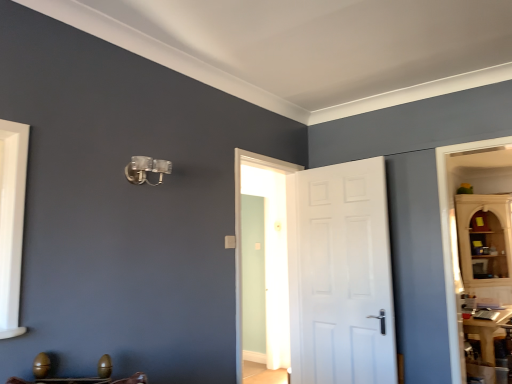
Measure the distance between white matte door at center and camera.

The distance of white matte door at center from camera is 9.39 feet.

Identify the location of white matte door at center. (340, 275).

Image resolution: width=512 pixels, height=384 pixels. What do you see at coordinates (340, 275) in the screenshot?
I see `white matte door at center` at bounding box center [340, 275].

What is the approximate width of wooden egg-shaped objects at lower left?

The width of wooden egg-shaped objects at lower left is 14.13 inches.

The height and width of the screenshot is (384, 512). Describe the element at coordinates (78, 378) in the screenshot. I see `wooden egg-shaped objects at lower left` at that location.

You are a GUI agent. You are given a task and a screenshot of the screen. Output one action in this format:
    pyautogui.click(x=<x>, y=<y>)
    Task: Click on the wooden egg-shaped objects at lower left
    
    Given the screenshot: What is the action you would take?
    pyautogui.click(x=78, y=378)

You are a GUI agent. You are given a task and a screenshot of the screen. Output one action in this format:
    pyautogui.click(x=<x>, y=<y>)
    Task: Click on the white matte door at center
    
    Given the screenshot: What is the action you would take?
    pyautogui.click(x=340, y=275)

Would you say wooden egg-shaped objects at lower left is to the left or to the right of white matte door at center in the picture?

Based on their positions, wooden egg-shaped objects at lower left is located to the left of white matte door at center.

Which object is closer to the camera, wooden egg-shaped objects at lower left or white matte door at center?

wooden egg-shaped objects at lower left.

Which is in front, point (76, 382) or point (303, 364)?

Point (76, 382)

From the image's perspective, is wooden egg-shaped objects at lower left positioned above or below white matte door at center?

Based on their image positions, wooden egg-shaped objects at lower left is located beneath white matte door at center.

From a real-world perspective, which is physically above, wooden egg-shaped objects at lower left or white matte door at center?

white matte door at center.

Is wooden egg-shaped objects at lower left wider than white matte door at center?

Yes.

Is wooden egg-shaped objects at lower left shorter than white matte door at center?

Yes, wooden egg-shaped objects at lower left is shorter than white matte door at center.

Does wooden egg-shaped objects at lower left have a larger size compared to white matte door at center?

Actually, wooden egg-shaped objects at lower left might be smaller than white matte door at center.

Do you think wooden egg-shaped objects at lower left is within white matte door at center, or outside of it?

wooden egg-shaped objects at lower left is spatially situated outside white matte door at center.

Is wooden egg-shaped objects at lower left not close to white matte door at center?

wooden egg-shaped objects at lower left is positioned a significant distance from white matte door at center.

Could you tell me if wooden egg-shaped objects at lower left is facing white matte door at center?

No, wooden egg-shaped objects at lower left is not facing towards white matte door at center.

How different are the orientations of wooden egg-shaped objects at lower left and white matte door at center in degrees?

The angular difference between wooden egg-shaped objects at lower left and white matte door at center is 2.64 degrees.

You are a GUI agent. You are given a task and a screenshot of the screen. Output one action in this format:
    pyautogui.click(x=<x>, y=<y>)
    Task: Click on the furniture that appears on the left of white matte door at center
    The height and width of the screenshot is (384, 512).
    Given the screenshot: What is the action you would take?
    pyautogui.click(x=78, y=378)

Does white matte door at center appear on the left side of wooden egg-shaped objects at lower left?

No, white matte door at center is not to the left of wooden egg-shaped objects at lower left.

Consider the image. Which object is further away from the camera taking this photo, white matte door at center or wooden egg-shaped objects at lower left?

white matte door at center.

Which is in front, point (381, 197) or point (117, 380)?

The point (117, 380) is in front.

From the image's perspective, is white matte door at center over wooden egg-shaped objects at lower left?

Yes, from the image's perspective, white matte door at center is on top of wooden egg-shaped objects at lower left.

From a real-world perspective, is white matte door at center located beneath wooden egg-shaped objects at lower left?

Incorrect, from a real-world perspective, white matte door at center is higher than wooden egg-shaped objects at lower left.

Considering the sizes of objects white matte door at center and wooden egg-shaped objects at lower left in the image provided, who is thinner, white matte door at center or wooden egg-shaped objects at lower left?

white matte door at center is thinner.

Considering the relative sizes of white matte door at center and wooden egg-shaped objects at lower left in the image provided, is white matte door at center taller than wooden egg-shaped objects at lower left?

Correct, white matte door at center is much taller as wooden egg-shaped objects at lower left.

Considering the sizes of objects white matte door at center and wooden egg-shaped objects at lower left in the image provided, who is bigger, white matte door at center or wooden egg-shaped objects at lower left?

white matte door at center is bigger.

Is wooden egg-shaped objects at lower left surrounded by white matte door at center?

No, wooden egg-shaped objects at lower left is located outside of white matte door at center.

Would you say white matte door at center is a long distance from wooden egg-shaped objects at lower left?

Indeed, white matte door at center is not near wooden egg-shaped objects at lower left.

Is white matte door at center facing away from wooden egg-shaped objects at lower left?

No, white matte door at center is not facing away from wooden egg-shaped objects at lower left.

Can you tell me how much white matte door at center and wooden egg-shaped objects at lower left differ in facing direction?

white matte door at center and wooden egg-shaped objects at lower left are facing 2.64 degrees away from each other.

In the image, there is a white matte door at center. What are the coordinates of `furniture below it (from a real-world perspective)` in the screenshot? It's located at (78, 378).

At what (x,y) coordinates should I click in order to perform the action: click on furniture directly beneath the white matte door at center (from a real-world perspective). Please return your answer as a coordinate pair (x, y). The width and height of the screenshot is (512, 384). Looking at the image, I should click on (78, 378).

Identify the location of furniture in front of the white matte door at center. The height and width of the screenshot is (384, 512). (78, 378).